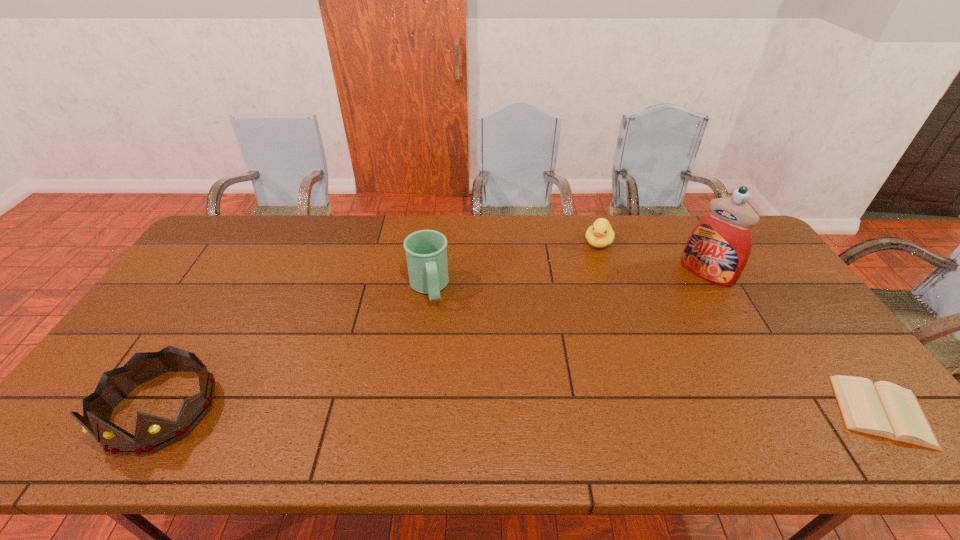
Where is `tiara`? The image size is (960, 540). tiara is located at coordinates (153, 433).

In order to click on the fourth object from right to left in this screenshot , I will do `click(426, 250)`.

Identify the location of the third tallest object. (426, 250).

You are a GUI agent. You are given a task and a screenshot of the screen. Output one action in this format:
    pyautogui.click(x=<x>, y=<y>)
    Task: Click on the fourth object from left to right
    This screenshot has width=960, height=540.
    Given the screenshot: What is the action you would take?
    pyautogui.click(x=718, y=248)

Find the location of a particular element. The image size is (960, 540). the tallest object is located at coordinates (718, 248).

Where is `the farthest object`? Image resolution: width=960 pixels, height=540 pixels. the farthest object is located at coordinates (600, 234).

You are a GUI agent. You are given a task and a screenshot of the screen. Output one action in this format:
    pyautogui.click(x=<x>, y=<y>)
    Task: Click on the fourth tallest object
    
    Given the screenshot: What is the action you would take?
    pyautogui.click(x=600, y=234)

Find the location of a particular element. The height and width of the screenshot is (540, 960). free point located on the side of the third tallest object with the handle is located at coordinates (439, 343).

I want to click on vacant area situated on the side of the third tallest object with the handle, so click(x=438, y=338).

This screenshot has height=540, width=960. What are the coordinates of `vacant space located 0.110m on the side of the third tallest object with the handle` in the screenshot? It's located at [438, 338].